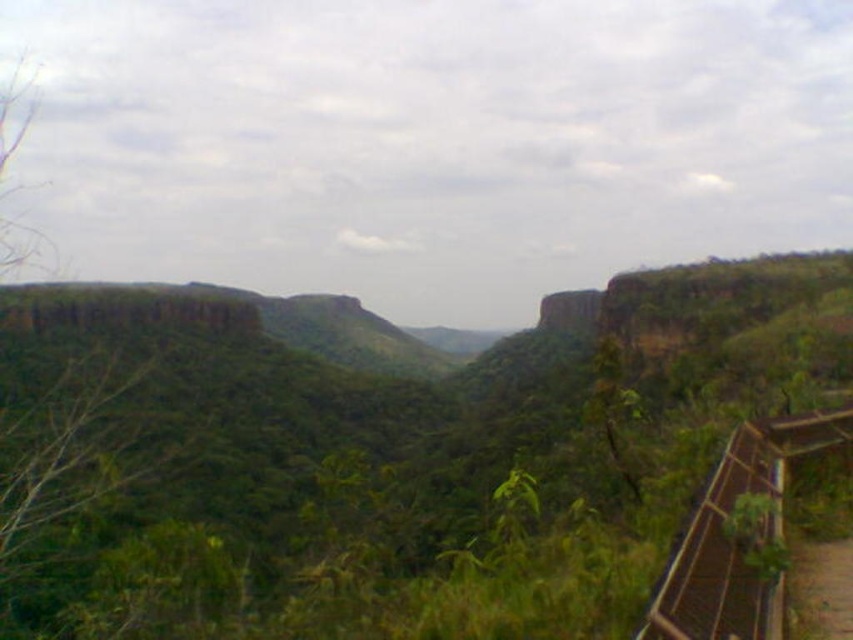
You are standing at the center of the valley and want to take a photo of the green leafy vegetation at center. Which direction should you face to capture it in your view?

The green leafy vegetation at center is located at point (392,460), so you should face towards the direction corresponding to those coordinates to capture it in your view.

You are a hiker planning to cross the valley. You see the green leafy vegetation at center and the brown wooden path at lower right. Which one is wider?

The green leafy vegetation at center is wider than the brown wooden path at lower right.

You are a hiker standing at the brown wooden path at lower right and want to reach the green leafy vegetation at center. Which direction should you move to get there?

The green leafy vegetation at center is to the left of the brown wooden path at lower right, so you should move to the left to reach it.